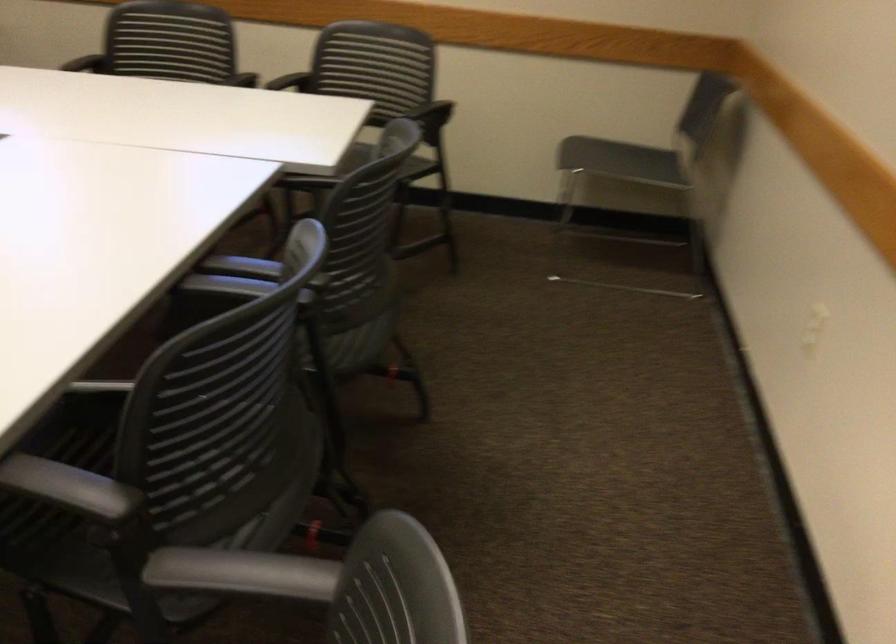
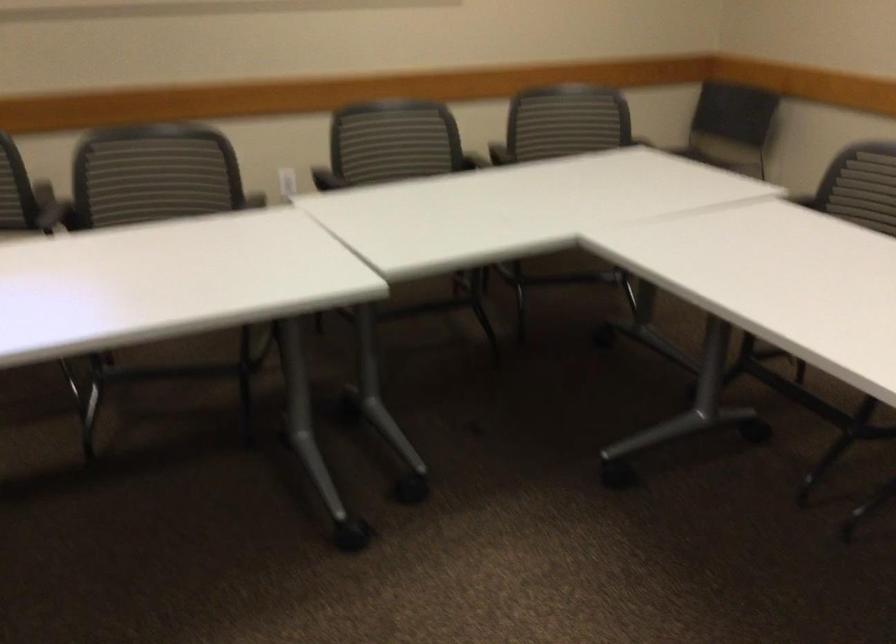
The point at (375, 183) is marked in the first image. Where is the corresponding point in the second image?

(866, 185)